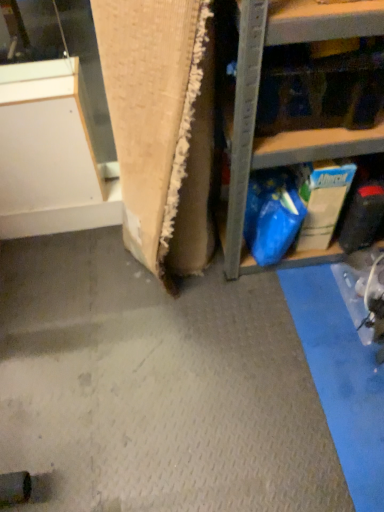
This screenshot has height=512, width=384. What do you see at coordinates (257, 103) in the screenshot? I see `blue plastic bag at upper right` at bounding box center [257, 103].

This screenshot has height=512, width=384. I want to click on blue plastic bag at upper right, so click(x=257, y=103).

In order to face blue plastic bag at upper right, should I rotate leftwards or rightwards?

To align with it, rotate right about 18.703°.

You are a GUI agent. You are given a task and a screenshot of the screen. Output one action in this format:
    pyautogui.click(x=<x>, y=<y>)
    Task: Click on the white matte cabinet at upper left
    This screenshot has width=384, height=512.
    Given the screenshot: What is the action you would take?
    pyautogui.click(x=51, y=154)

This screenshot has height=512, width=384. Describe the element at coordinates (51, 154) in the screenshot. I see `white matte cabinet at upper left` at that location.

What is the approximate height of white matte cabinet at upper left?

white matte cabinet at upper left is 17.67 inches in height.

Find the location of `blue plastic bag at upper right`. blue plastic bag at upper right is located at coordinates (257, 103).

Is blue plastic bag at upper right at the right side of white matte cabinet at upper left?

Yes, blue plastic bag at upper right is to the right of white matte cabinet at upper left.

Is blue plastic bag at upper right positioned before white matte cabinet at upper left?

Yes, the depth of blue plastic bag at upper right is less than that of white matte cabinet at upper left.

Is point (373, 148) closer to viewer compared to point (94, 212)?

Yes, point (373, 148) is in front of point (94, 212).

From the image's perspective, is blue plastic bag at upper right positioned above or below white matte cabinet at upper left?

From the image's perspective, blue plastic bag at upper right appears above white matte cabinet at upper left.

From a real-world perspective, which object rests below the other?

From a 3D spatial view, white matte cabinet at upper left is below.

Which of these two, blue plastic bag at upper right or white matte cabinet at upper left, is wider?

Wider between the two is blue plastic bag at upper right.

Does blue plastic bag at upper right have a lesser height compared to white matte cabinet at upper left?

In fact, blue plastic bag at upper right may be taller than white matte cabinet at upper left.

Based on the photo, between blue plastic bag at upper right and white matte cabinet at upper left, which one has smaller size?

Smaller between the two is white matte cabinet at upper left.

Is blue plastic bag at upper right positioned beyond the bounds of white matte cabinet at upper left?

Yes, blue plastic bag at upper right is outside of white matte cabinet at upper left.

Looking at this image, is blue plastic bag at upper right with white matte cabinet at upper left?

blue plastic bag at upper right is not next to white matte cabinet at upper left, and they're not touching.

Based on the photo, is blue plastic bag at upper right oriented towards white matte cabinet at upper left?

No, blue plastic bag at upper right is not turned towards white matte cabinet at upper left.

The image size is (384, 512). What are the coordinates of `shelf in front of the white matte cabinet at upper left` in the screenshot? It's located at (257, 103).

Between white matte cabinet at upper left and blue plastic bag at upper right, which one appears on the left side from the viewer's perspective?

From the viewer's perspective, white matte cabinet at upper left appears more on the left side.

Does white matte cabinet at upper left come behind blue plastic bag at upper right?

Yes, the depth of white matte cabinet at upper left is greater than that of blue plastic bag at upper right.

Is point (18, 67) behind point (235, 104)?

Yes.

From the image's perspective, is white matte cabinet at upper left beneath blue plastic bag at upper right?

Indeed, from the image's perspective, white matte cabinet at upper left is shown beneath blue plastic bag at upper right.

From a real-world perspective, is white matte cabinet at upper left positioned above or below blue plastic bag at upper right?

In terms of real-world spatial position, white matte cabinet at upper left is below blue plastic bag at upper right.

Based on the photo, in terms of width, does white matte cabinet at upper left look wider or thinner when compared to blue plastic bag at upper right?

white matte cabinet at upper left is thinner than blue plastic bag at upper right.

Considering the sizes of objects white matte cabinet at upper left and blue plastic bag at upper right in the image provided, who is taller, white matte cabinet at upper left or blue plastic bag at upper right?

blue plastic bag at upper right.

Is white matte cabinet at upper left bigger than blue plastic bag at upper right?

No.

Is white matte cabinet at upper left inside the boundaries of blue plastic bag at upper right, or outside?

white matte cabinet at upper left is located beyond the bounds of blue plastic bag at upper right.

Is white matte cabinet at upper left touching blue plastic bag at upper right?

No, white matte cabinet at upper left is not making contact with blue plastic bag at upper right.

Is white matte cabinet at upper left facing away from blue plastic bag at upper right?

No, white matte cabinet at upper left's orientation is not away from blue plastic bag at upper right.

What's the angular difference between white matte cabinet at upper left and blue plastic bag at upper right's facing directions?

The facing directions of white matte cabinet at upper left and blue plastic bag at upper right are 0.18 degrees apart.

How distant is white matte cabinet at upper left from blue plastic bag at upper right?

They are 23.07 inches apart.

The width and height of the screenshot is (384, 512). Find the location of `shelf on the right of white matte cabinet at upper left`. shelf on the right of white matte cabinet at upper left is located at coordinates (257, 103).

Locate an element on the screen. This screenshot has height=512, width=384. shelf in front of the white matte cabinet at upper left is located at coordinates (257, 103).

Where is `shelf on the right of white matte cabinet at upper left`? Image resolution: width=384 pixels, height=512 pixels. shelf on the right of white matte cabinet at upper left is located at coordinates (257, 103).